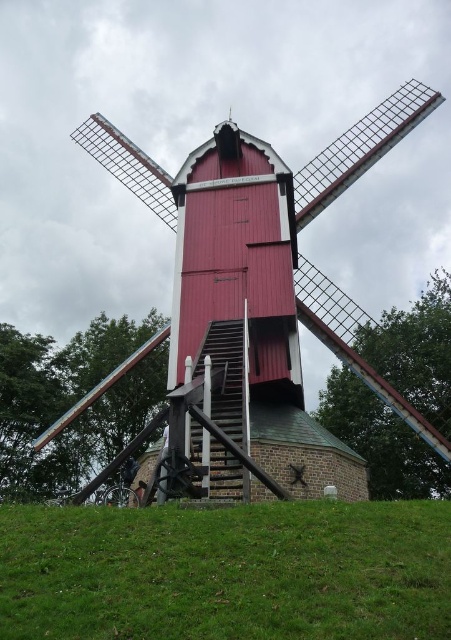
Locate an element on the screen. The width and height of the screenshot is (451, 640). green grassy hill at lower center is located at coordinates point(226,572).

Which is in front, point (408, 532) or point (363, 134)?

Point (408, 532) is more forward.

Where is `green grassy hill at lower center`? The height and width of the screenshot is (640, 451). green grassy hill at lower center is located at coordinates (226, 572).